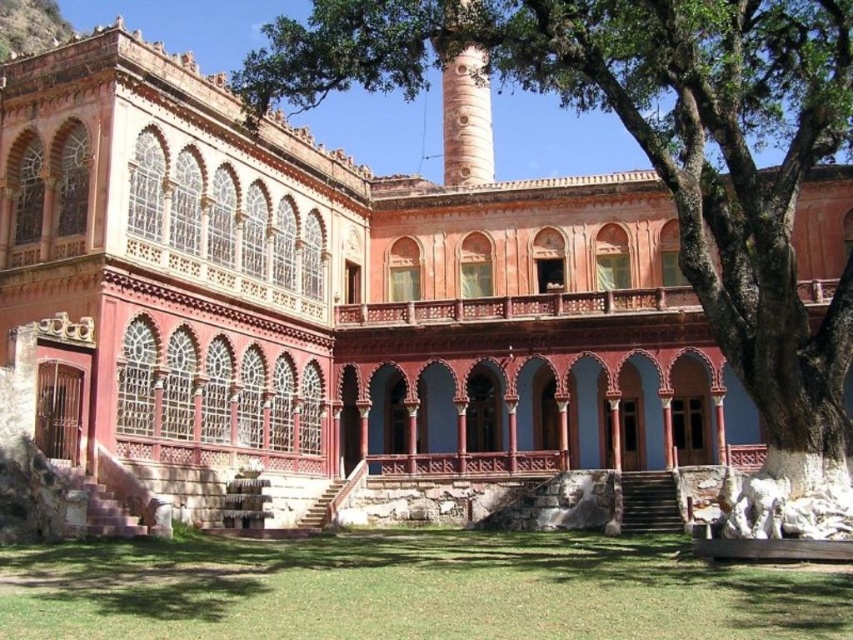
Measure the distance between green leafy tree at upper center and camera.

They are 122.08 feet apart.

Is green leafy tree at upper center bigger than green grass at lower center?

Yes, green leafy tree at upper center is bigger than green grass at lower center.

What do you see at coordinates (660, 157) in the screenshot? This screenshot has width=853, height=640. I see `green leafy tree at upper center` at bounding box center [660, 157].

In order to click on green leafy tree at upper center in this screenshot , I will do `click(660, 157)`.